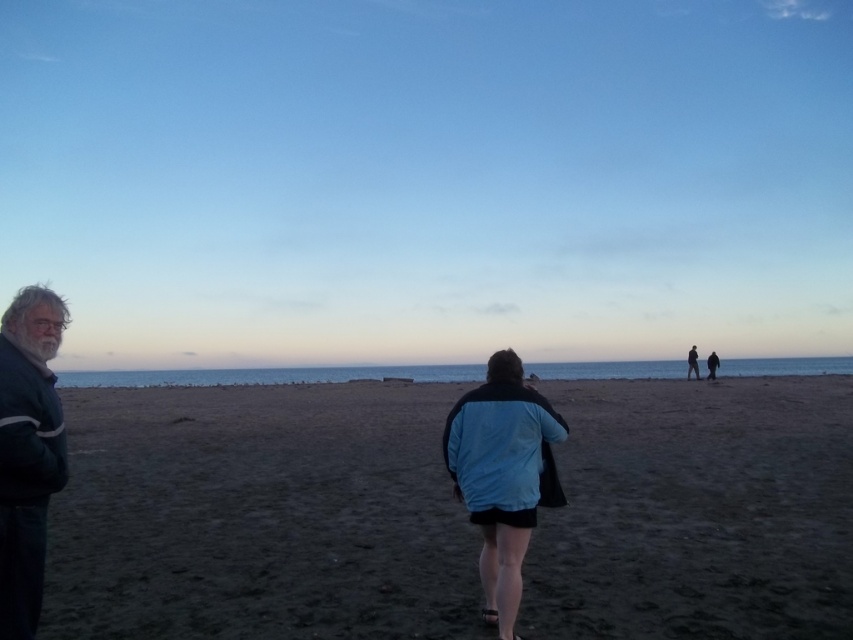
Question: Among these objects, which one is farthest from the camera?

Choices:
 (A) dark blue jacket at left
 (B) blue fabric jacket at center

Answer: (B)

Question: Can you confirm if blue fabric jacket at center is bigger than dark blue jacket at center-right?

Choices:
 (A) yes
 (B) no

Answer: (B)

Question: Is blue fabric jacket at center positioned behind dark blue jacket at center-right?

Choices:
 (A) yes
 (B) no

Answer: (B)

Question: Which point is closer to the camera taking this photo?

Choices:
 (A) (697, 372)
 (B) (0, 481)
 (C) (518, 560)

Answer: (B)

Question: Can you confirm if dark sand at center is positioned above dark blue jacket at center-right?

Choices:
 (A) no
 (B) yes

Answer: (A)

Question: Which object appears closest to the camera in this image?

Choices:
 (A) dark sand at center
 (B) blue fabric jacket at center
 (C) dark blue jacket at left

Answer: (C)